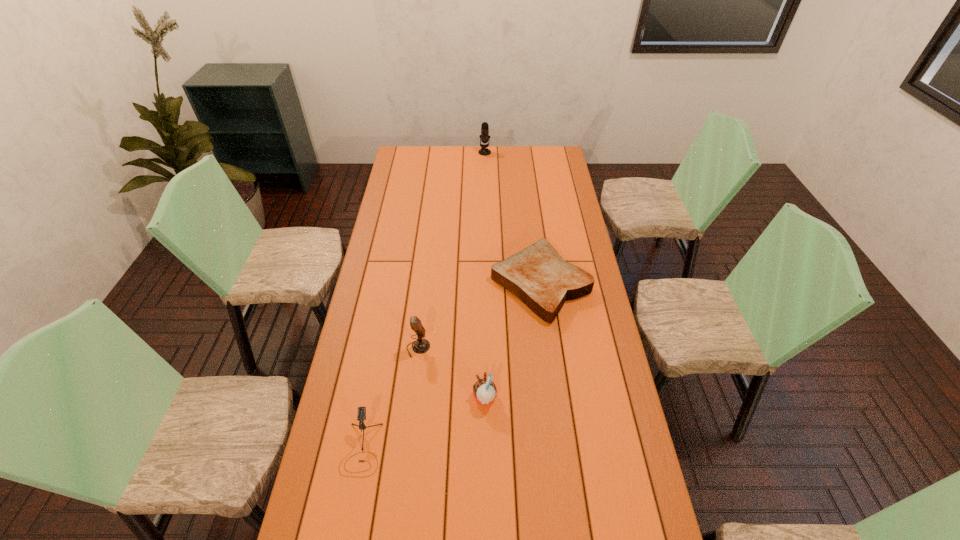
Where is `vacant region between the nearest microphone and the second nearest microphone`? vacant region between the nearest microphone and the second nearest microphone is located at coordinates (390, 398).

The height and width of the screenshot is (540, 960). Find the location of `blank region between the farthest microphone and the bread`. blank region between the farthest microphone and the bread is located at coordinates (513, 218).

The image size is (960, 540). I want to click on free point between the muffin and the leftmost microphone, so click(423, 423).

The width and height of the screenshot is (960, 540). In order to click on object that stands as the fourth closest to the leftmost microphone in this screenshot , I will do `click(484, 137)`.

Point out which object is positioned as the third nearest to the fourth farthest object. Please provide its 2D coordinates. Your answer should be formatted as a tuple, i.e. [(x, y)], where the tuple contains the x and y coordinates of a point satisfying the conditions above.

[(361, 415)]

Select which microphone is the second closest to the leftmost microphone. Please provide its 2D coordinates. Your answer should be formatted as a tuple, i.e. [(x, y)], where the tuple contains the x and y coordinates of a point satisfying the conditions above.

[(484, 137)]

What are the coordinates of `microphone that is the second nearest to the second tallest microphone` in the screenshot? It's located at (484, 137).

Find the location of a particular element. This screenshot has height=540, width=960. vacant position in the image that satisfies the following two spatial constraints: 1. on the front-facing side of the second microphone from right to left; 2. on the stand of the leftmost object is located at coordinates (406, 448).

Identify the location of vacant position in the image that satisfies the following two spatial constraints: 1. on the front side of the bread; 2. on the front-facing side of the second farthest microphone. This screenshot has height=540, width=960. (549, 348).

Locate an element on the screen. free region that satisfies the following two spatial constraints: 1. on the front side of the shortest object; 2. on the front-facing side of the third nearest object is located at coordinates [549, 348].